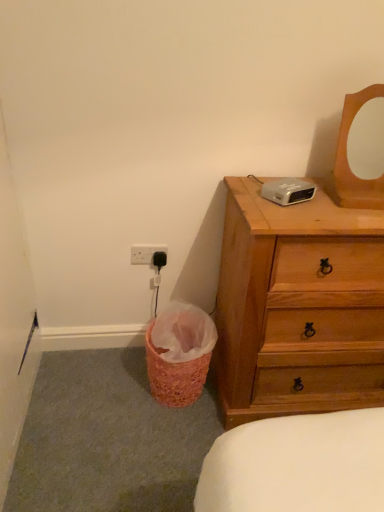
What do you see at coordinates (298, 307) in the screenshot?
I see `wooden chest of drawers at right` at bounding box center [298, 307].

In order to face wooden chest of drawers at right, should I rotate leftwards or rightwards?

It's best to rotate right around 18.448 degrees.

I want to click on pink woven basket at lower left, so click(x=174, y=375).

Is point (173, 395) closer to camera compared to point (162, 249)?

Yes, it is.

This screenshot has height=512, width=384. Find the location of `basket that appears below the white plastic electric outlet at lower left (from a real-world perspective)`. basket that appears below the white plastic electric outlet at lower left (from a real-world perspective) is located at coordinates (174, 375).

Looking at this image, is pink woven basket at lower left closer to the viewer compared to white plastic electric outlet at lower left?

That is True.

Is pink woven basket at lower left at the left side of white plastic electric outlet at lower left?

No, pink woven basket at lower left is not to the left of white plastic electric outlet at lower left.

Considering the positions of point (250, 394) and point (148, 250), is point (250, 394) closer or farther from the camera than point (148, 250)?

Point (250, 394) appears to be closer to the viewer than point (148, 250).

What's the angular difference between wooden chest of drawers at right and white plastic electric outlet at lower left's facing directions?

The facing directions of wooden chest of drawers at right and white plastic electric outlet at lower left are 1.42 degrees apart.

From the image's perspective, which one is positioned higher, wooden chest of drawers at right or white plastic electric outlet at lower left?

white plastic electric outlet at lower left.

Between wooden chest of drawers at right and white plastic electric outlet at lower left, which one has smaller size?

Smaller between the two is white plastic electric outlet at lower left.

Considering the positions of objects white plastic electric outlet at lower left and pink woven basket at lower left in the image provided, who is in front, white plastic electric outlet at lower left or pink woven basket at lower left?

pink woven basket at lower left is closer to the camera.

Identify the location of electric outlet positioned vertically above the pink woven basket at lower left (from a real-world perspective). The image size is (384, 512). (145, 253).

Looking at this image, is white plastic electric outlet at lower left not within pink woven basket at lower left?

That's correct, white plastic electric outlet at lower left is outside of pink woven basket at lower left.

From a real-world perspective, does white plastic electric outlet at lower left sit lower than pink woven basket at lower left?

No.

Is wooden chest of drawers at right inside the boundaries of pink woven basket at lower left, or outside?

wooden chest of drawers at right is outside pink woven basket at lower left.

Is wooden chest of drawers at right far away from pink woven basket at lower left?

No, wooden chest of drawers at right is not far from pink woven basket at lower left.

Considering the sizes of objects wooden chest of drawers at right and pink woven basket at lower left in the image provided, who is smaller, wooden chest of drawers at right or pink woven basket at lower left?

With smaller size is pink woven basket at lower left.

Is wooden chest of drawers at right wider or thinner than wooden mirror at upper right?

wooden chest of drawers at right is wider than wooden mirror at upper right.

From the picture: How much distance is there between wooden chest of drawers at right and wooden mirror at upper right?

They are 17.46 inches apart.

Could you tell me if wooden chest of drawers at right is facing wooden mirror at upper right?

No, wooden chest of drawers at right does not turn towards wooden mirror at upper right.

Can you confirm if wooden chest of drawers at right is positioned to the left of wooden mirror at upper right?

Yes, wooden chest of drawers at right is to the left of wooden mirror at upper right.

Can you confirm if wooden mirror at upper right is bigger than wooden chest of drawers at right?

Actually, wooden mirror at upper right might be smaller than wooden chest of drawers at right.

What's the angular difference between wooden mirror at upper right and wooden chest of drawers at right's facing directions?

4.14 degrees separate the facing orientations of wooden mirror at upper right and wooden chest of drawers at right.

Is wooden mirror at upper right wider or thinner than wooden chest of drawers at right?

In the image, wooden mirror at upper right appears to be more narrow than wooden chest of drawers at right.

From the image's perspective, who appears lower, wooden mirror at upper right or wooden chest of drawers at right?

wooden chest of drawers at right is shown below in the image.

Does white plastic electric outlet at lower left turn towards wooden chest of drawers at right?

No, white plastic electric outlet at lower left does not turn towards wooden chest of drawers at right.

Is white plastic electric outlet at lower left bigger or smaller than wooden chest of drawers at right?

Considering their sizes, white plastic electric outlet at lower left takes up less space than wooden chest of drawers at right.

Considering the sizes of objects white plastic electric outlet at lower left and wooden chest of drawers at right in the image provided, who is shorter, white plastic electric outlet at lower left or wooden chest of drawers at right?

white plastic electric outlet at lower left.

The height and width of the screenshot is (512, 384). Identify the location of basket that appears in front of the white plastic electric outlet at lower left. (174, 375).

Identify the location of chest of drawers below the white plastic electric outlet at lower left (from the image's perspective). Image resolution: width=384 pixels, height=512 pixels. (298, 307).

From the image, which object appears to be nearer to white plastic electric outlet at lower left, wooden mirror at upper right or pink woven basket at lower left?

pink woven basket at lower left is closer to white plastic electric outlet at lower left.

From the image, which object appears to be nearer to wooden mirror at upper right, wooden chest of drawers at right or pink woven basket at lower left?

wooden chest of drawers at right is closer to wooden mirror at upper right.

Based on the photo, based on their spatial positions, is pink woven basket at lower left or white plastic electric outlet at lower left closer to wooden mirror at upper right?

The object closer to wooden mirror at upper right is white plastic electric outlet at lower left.

Looking at the image, which one is located further to wooden chest of drawers at right, white plastic electric outlet at lower left or pink woven basket at lower left?

white plastic electric outlet at lower left is positioned further to the anchor wooden chest of drawers at right.

Considering their positions, is pink woven basket at lower left positioned further to white plastic electric outlet at lower left than wooden mirror at upper right?

wooden mirror at upper right lies further to white plastic electric outlet at lower left than the other object.

Looking at the image, which one is located further to pink woven basket at lower left, wooden mirror at upper right or white plastic electric outlet at lower left?

The object further to pink woven basket at lower left is wooden mirror at upper right.

When comparing their distances from pink woven basket at lower left, does wooden chest of drawers at right or wooden mirror at upper right seem closer?

Based on the image, wooden chest of drawers at right appears to be nearer to pink woven basket at lower left.

Looking at this image, based on their spatial positions, is pink woven basket at lower left or wooden chest of drawers at right further from white plastic electric outlet at lower left?

The object further to white plastic electric outlet at lower left is wooden chest of drawers at right.

Locate an element on the screen. This screenshot has height=512, width=384. chest of drawers between wooden mirror at upper right and pink woven basket at lower left from top to bottom is located at coordinates (298, 307).

At what (x,y) coordinates should I click in order to perform the action: click on basket between white plastic electric outlet at lower left and wooden mirror at upper right in the horizontal direction. Please return your answer as a coordinate pair (x, y). Image resolution: width=384 pixels, height=512 pixels. Looking at the image, I should click on (174, 375).

Locate an element on the screen. This screenshot has height=512, width=384. basket between white plastic electric outlet at lower left and wooden chest of drawers at right in the horizontal direction is located at coordinates (174, 375).

What are the coordinates of `the chest of drawers located between white plastic electric outlet at lower left and wooden mirror at upper right in the left-right direction` in the screenshot? It's located at (298, 307).